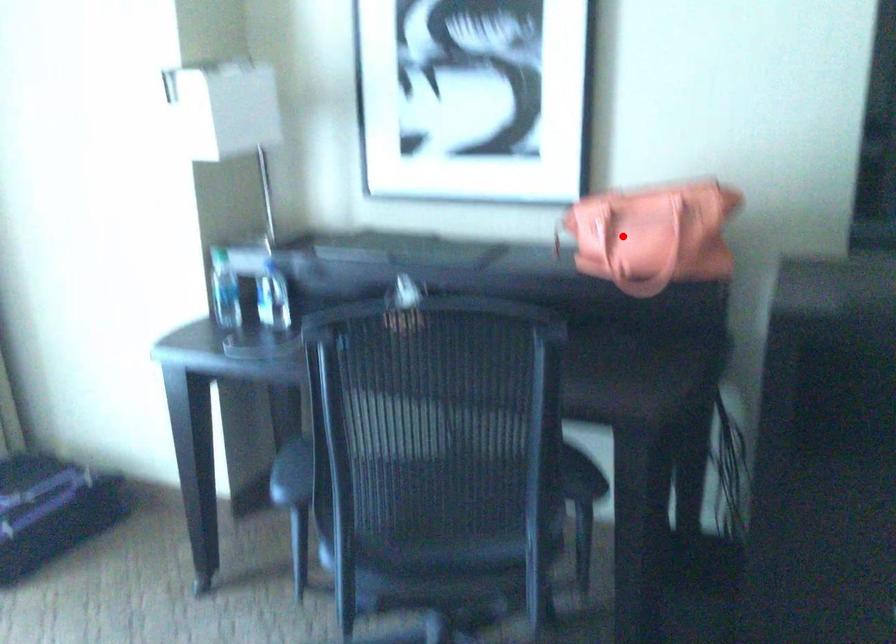
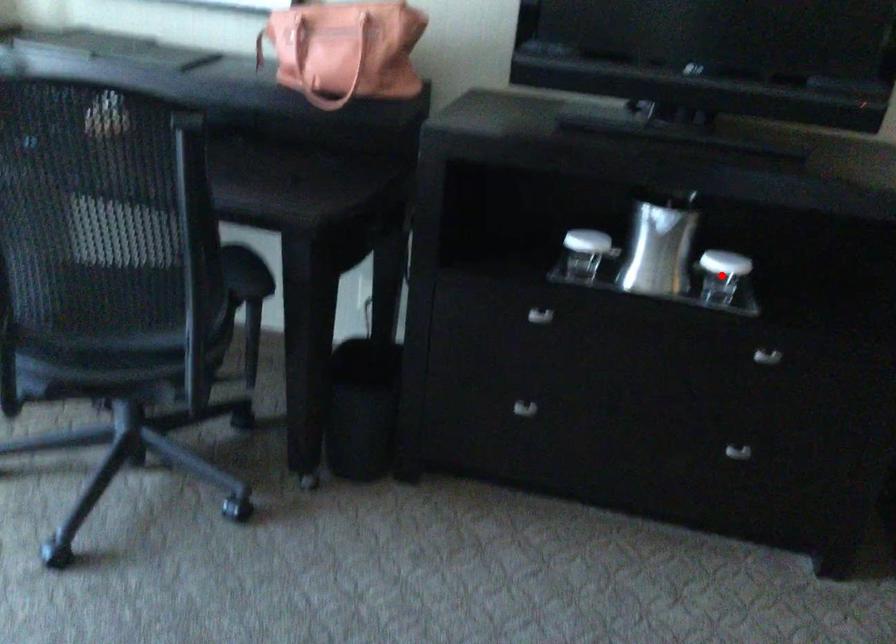
I am providing you with two images of the same scene from different viewpoints. A red point is marked on the first image and another point is marked on the second image. Is the marked point in image1 the same physical position as the marked point in image2?

No